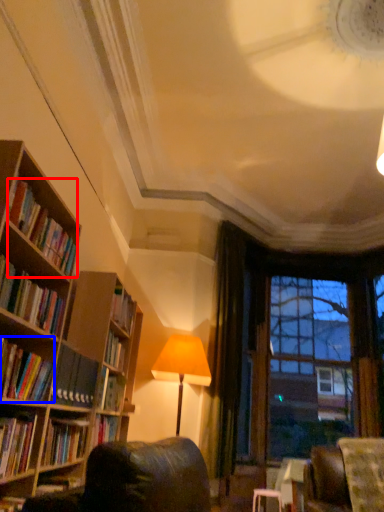
Question: Among these objects, which one is farthest to the camera, book (highlighted by a red box) or book (highlighted by a blue box)?

Choices:
 (A) book
 (B) book

Answer: (A)